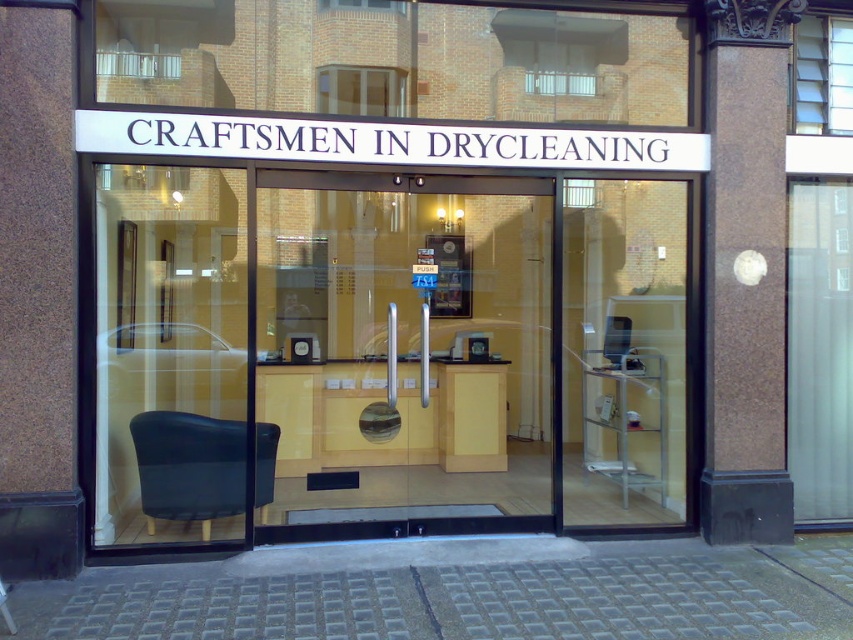
You are a customer standing in front of the dry cleaning store. You want to enter through the transparent glass door at center. Which direction should you move relative to the transparent glass door at left?

The transparent glass door at center is located below the transparent glass door at left, so you should move downward towards the transparent glass door at center to enter.

Consider the image. You are a customer standing in front of the store entrance. You need to enter the store but the door is closed. Which object is closer to you, the transparent glass door at left or the matte black chair at left?

The transparent glass door at left is closer to you because it is positioned to the left of the matte black chair at left, meaning it is in front of the chair from your perspective.